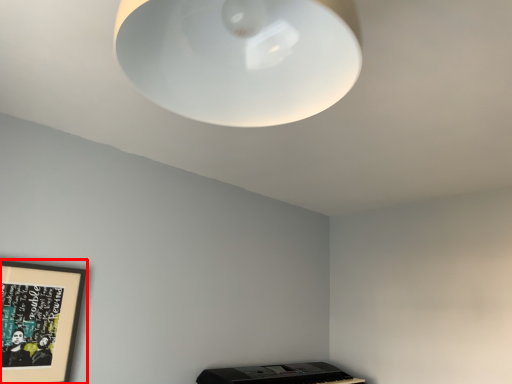
Question: From the image, what is the correct spatial relationship of picture frame (annotated by the red box) in relation to lamp?

Choices:
 (A) left
 (B) right

Answer: (A)